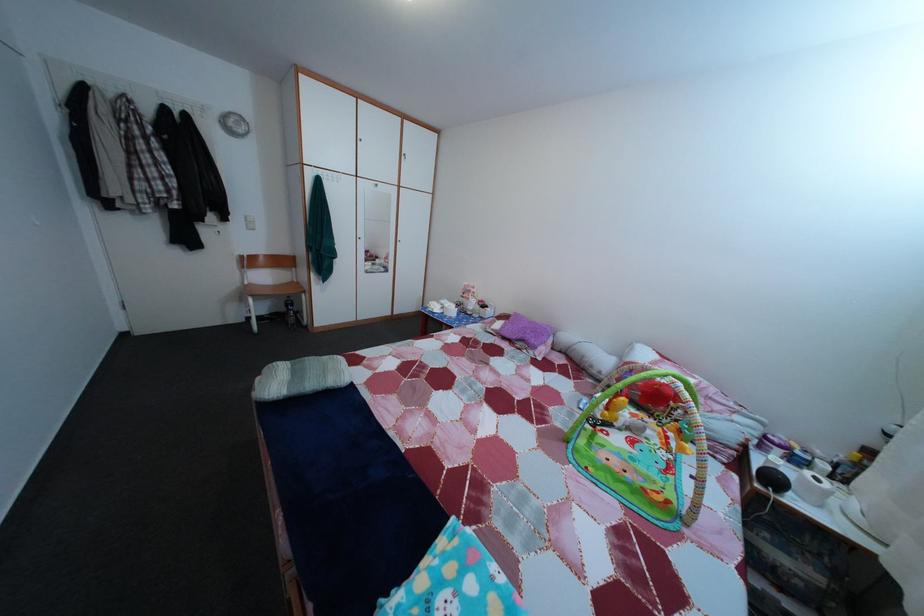
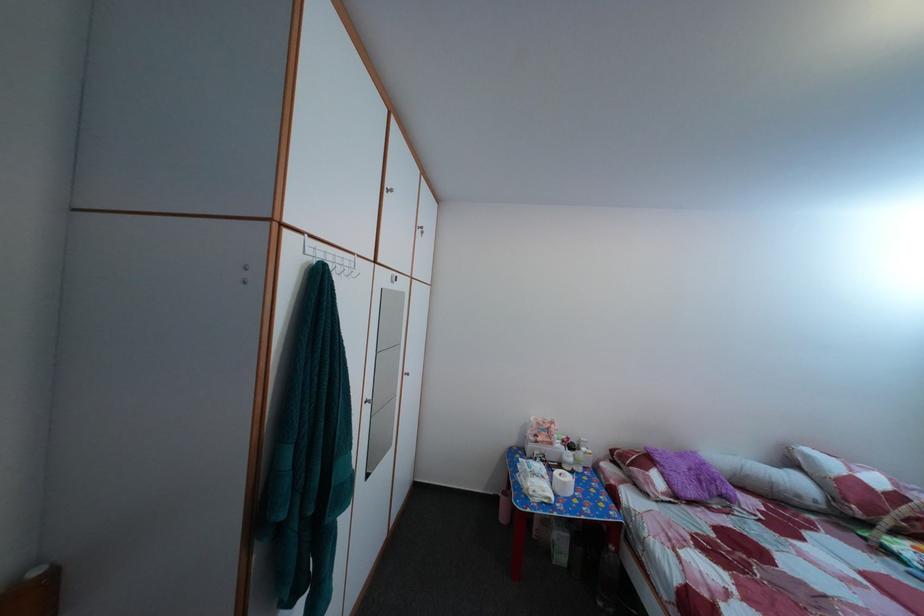
Where in the second image is the point corresponding to (541,330) from the first image?

(689, 464)